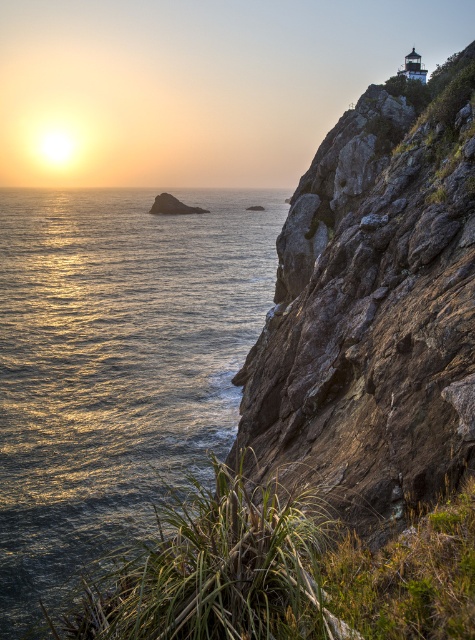
Question: Does shiny metallic water at left have a larger size compared to rusty stone cliff at upper right?

Choices:
 (A) yes
 (B) no

Answer: (A)

Question: Which object is closer to the camera taking this photo?

Choices:
 (A) shiny metallic water at left
 (B) rusty stone cliff at upper right

Answer: (B)

Question: Considering the relative positions of shiny metallic water at left and rusty stone cliff at upper right in the image provided, where is shiny metallic water at left located with respect to rusty stone cliff at upper right?

Choices:
 (A) below
 (B) above

Answer: (B)

Question: Which object is farther from the camera taking this photo?

Choices:
 (A) shiny metallic water at left
 (B) rusty stone cliff at upper right

Answer: (A)

Question: Is shiny metallic water at left wider than rusty stone cliff at upper right?

Choices:
 (A) no
 (B) yes

Answer: (B)

Question: Which object appears closest to the camera in this image?

Choices:
 (A) rusty stone cliff at upper right
 (B) shiny metallic water at left

Answer: (A)